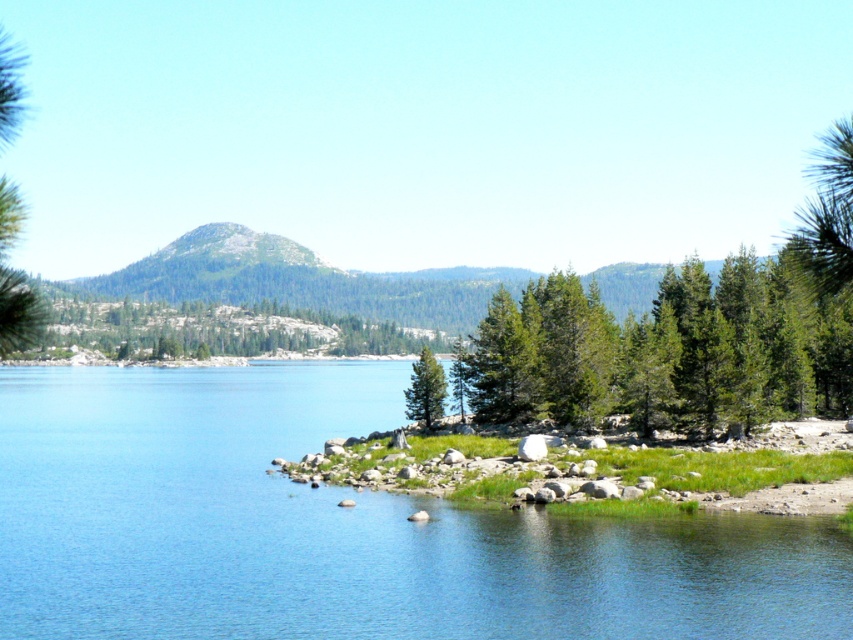
Between clear blue water at lower center and green matte tree at center, which one is positioned lower?

Positioned lower is clear blue water at lower center.

Can you confirm if clear blue water at lower center is positioned above green matte tree at center?

Actually, clear blue water at lower center is below green matte tree at center.

The height and width of the screenshot is (640, 853). Describe the element at coordinates (341, 529) in the screenshot. I see `clear blue water at lower center` at that location.

You are a GUI agent. You are given a task and a screenshot of the screen. Output one action in this format:
    pyautogui.click(x=<x>, y=<y>)
    Task: Click on the clear blue water at lower center
    
    Given the screenshot: What is the action you would take?
    pyautogui.click(x=341, y=529)

Is green matte tree at center to the right of green textured tree at center from the viewer's perspective?

Yes, green matte tree at center is to the right of green textured tree at center.

Is point (491, 346) less distant than point (440, 385)?

No, it is not.

Is point (505, 364) less distant than point (431, 400)?

No, (505, 364) is further to viewer.

Locate an element on the screen. green matte tree at center is located at coordinates (503, 365).

Image resolution: width=853 pixels, height=640 pixels. What do you see at coordinates (341, 529) in the screenshot? I see `clear blue water at lower center` at bounding box center [341, 529].

Between clear blue water at lower center and green textured tree at center, which one is positioned lower?

clear blue water at lower center is below.

What do you see at coordinates (341, 529) in the screenshot?
I see `clear blue water at lower center` at bounding box center [341, 529].

Identify the location of clear blue water at lower center. (341, 529).